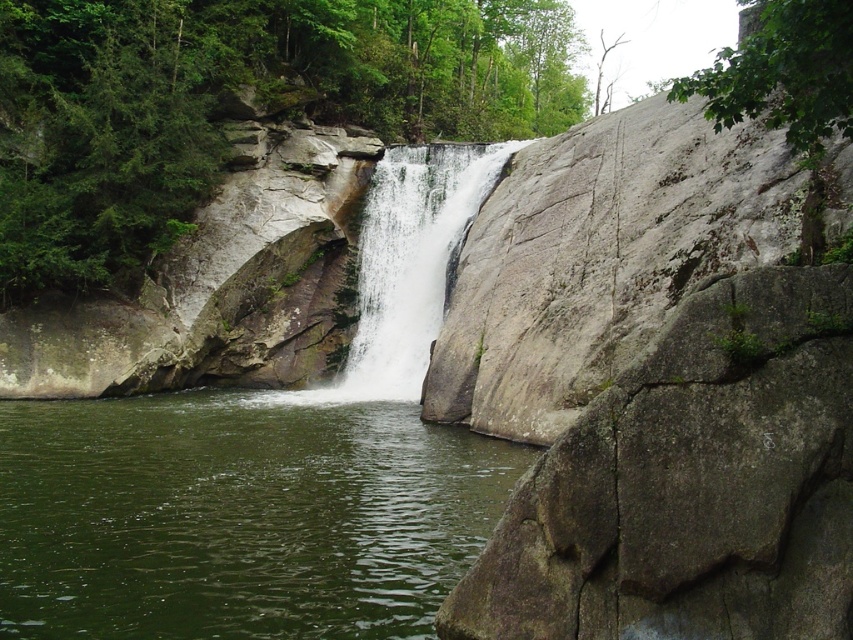
Where is `green liquid water at center`? green liquid water at center is located at coordinates (238, 515).

Does green liquid water at center have a greater height compared to gray rough rock at right?

Incorrect, green liquid water at center's height is not larger of gray rough rock at right's.

Does point (488, 524) lie behind point (724, 276)?

No, (488, 524) is in front of (724, 276).

Locate an element on the screen. Image resolution: width=853 pixels, height=640 pixels. green liquid water at center is located at coordinates click(238, 515).

Who is positioned more to the left, gray rough rock at right or white smooth waterfall at center?

white smooth waterfall at center

From the picture: Can you confirm if gray rough rock at right is thinner than white smooth waterfall at center?

Correct, gray rough rock at right's width is less than white smooth waterfall at center's.

Locate an element on the screen. The height and width of the screenshot is (640, 853). gray rough rock at right is located at coordinates (692, 483).

You are a GUI agent. You are given a task and a screenshot of the screen. Output one action in this format:
    pyautogui.click(x=<x>, y=<y>)
    Task: Click on the gray rough rock at right
    The image size is (853, 640).
    Given the screenshot: What is the action you would take?
    pyautogui.click(x=692, y=483)

Who is shorter, green liquid water at center or white smooth waterfall at center?

green liquid water at center is shorter.

Is the position of green liquid water at center more distant than that of white smooth waterfall at center?

No, green liquid water at center is in front of white smooth waterfall at center.

Locate an element on the screen. green liquid water at center is located at coordinates (238, 515).